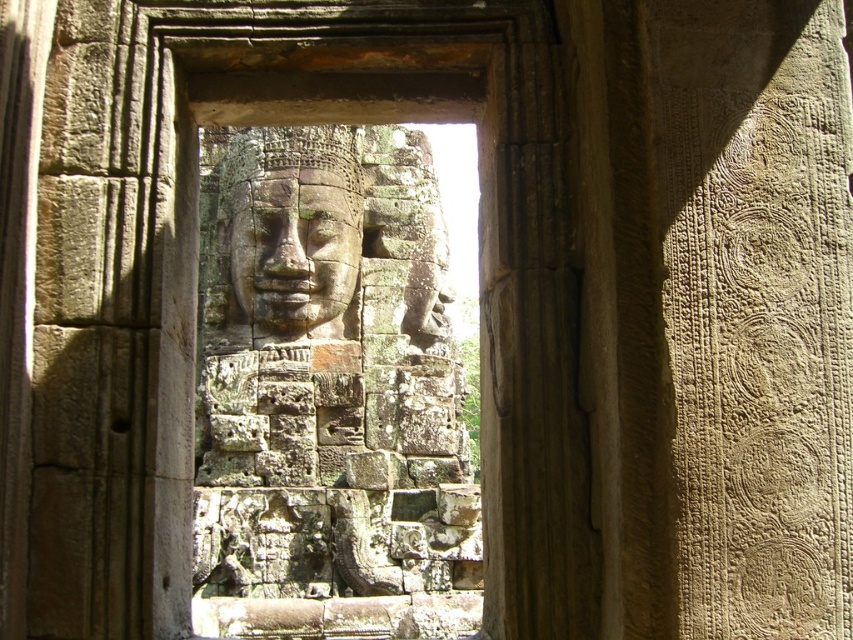
You are an archaeologist examining the stone doorway. You notice two faces carved into the wall. Which one is located lower down between the weathered stone face at center and the carved stone face at center?

The weathered stone face at center is positioned under the carved stone face at center, so it is located lower down.

You are an archaeologist examining the stone doorway. You notice two faces carved into the wall. The weathered stone face at center and the carved stone face at center. Which one is bigger?

The weathered stone face at center is larger in size compared to the carved stone face at center.

You are an archaeologist examining the stone doorway. You notice two faces carved into the wall. The weathered stone face at center and the carved stone face at center. Which one is taller?

The weathered stone face at center is taller than the carved stone face at center.